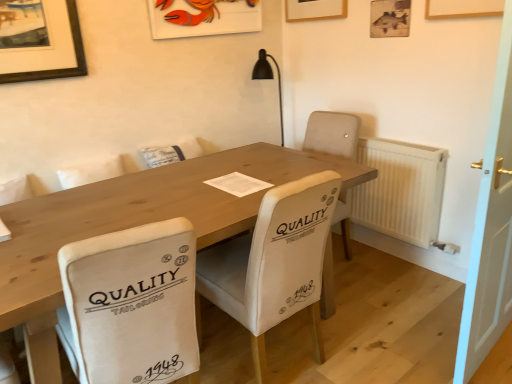
Identify the location of vacant space that is to the left of white wooden door at right. The height and width of the screenshot is (384, 512). (397, 330).